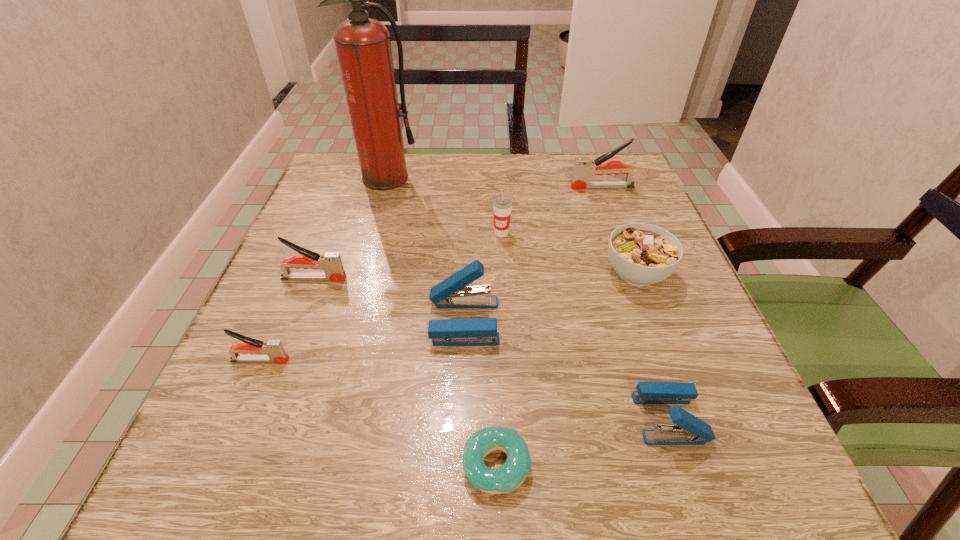
Locate an element on the screen. free space that satisfies the following two spatial constraints: 1. on the back side of the nearer blue stapler; 2. on the right side of the white soup bowl is located at coordinates (621, 273).

This screenshot has width=960, height=540. In order to click on free spot that satisfies the following two spatial constraints: 1. on the back side of the white soup bowl; 2. on the handle side of the biggest gray stapler in this screenshot , I will do `click(605, 187)`.

You are a GUI agent. You are given a task and a screenshot of the screen. Output one action in this format:
    pyautogui.click(x=<x>, y=<y>)
    Task: Click on the vacant region that satisfies the following two spatial constraints: 1. at the nozzle of the red fire extinguisher; 2. on the handle side of the nearest gray stapler
    
    Given the screenshot: What is the action you would take?
    pyautogui.click(x=334, y=360)

At what (x,y) coordinates should I click in order to perform the action: click on vacant space that satisfies the following two spatial constraints: 1. on the back side of the nearest stapler; 2. on the handle side of the second biggest gray stapler. Please return your answer as a coordinate pair (x, y). Looking at the image, I should click on (623, 279).

At what (x,y) coordinates should I click in order to perform the action: click on vacant area in the image that satisfies the following two spatial constraints: 1. on the handle side of the shortest object; 2. on the left side of the second farthest gray stapler. Please return your answer as a coordinate pair (x, y). Looking at the image, I should click on (242, 465).

Where is `free point that satisfies the following two spatial constraints: 1. on the back side of the right blue stapler; 2. on the handle side of the smallest gray stapler`? free point that satisfies the following two spatial constraints: 1. on the back side of the right blue stapler; 2. on the handle side of the smallest gray stapler is located at coordinates click(x=650, y=360).

Where is `free space that satisfies the following two spatial constraints: 1. at the nozzle of the shortest object; 2. on the left side of the tallest object`? The height and width of the screenshot is (540, 960). free space that satisfies the following two spatial constraints: 1. at the nozzle of the shortest object; 2. on the left side of the tallest object is located at coordinates (304, 465).

Locate an element on the screen. The width and height of the screenshot is (960, 540). vacant space that satisfies the following two spatial constraints: 1. on the back side of the soup bowl; 2. on the left side of the nearer blue stapler is located at coordinates (621, 273).